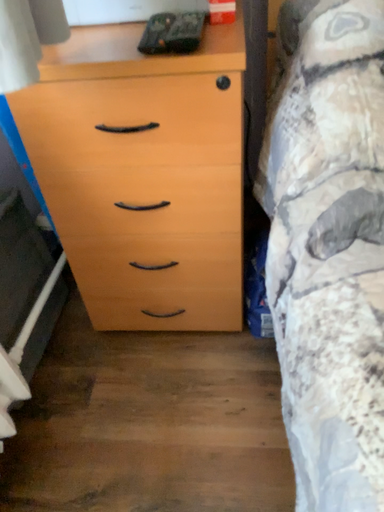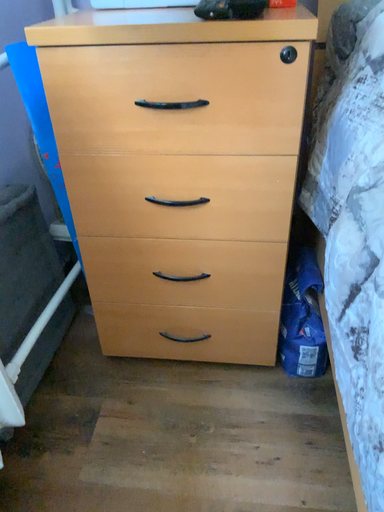
Question: How did the camera likely rotate when shooting the video?

Choices:
 (A) rotated downward
 (B) rotated upward

Answer: (B)